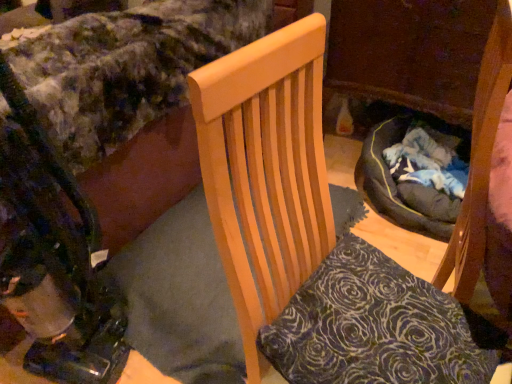
What do you see at coordinates (377, 327) in the screenshot? I see `velvety dark blue pillow at center` at bounding box center [377, 327].

The image size is (512, 384). Describe the element at coordinates (265, 171) in the screenshot. I see `wooden chair at center` at that location.

What do you see at coordinates (52, 256) in the screenshot?
I see `metallic black baby carriage at lower left` at bounding box center [52, 256].

Identify the location of velvety floral bedspread at upper left. (131, 97).

Are wooden chair at center and metallic black baby carriage at lower left located far from each other?

wooden chair at center is actually quite close to metallic black baby carriage at lower left.

Is wooden chair at center inside the boundaries of metallic black baby carriage at lower left, or outside?

The correct answer is: outside.

From the image's perspective, is wooden chair at center beneath metallic black baby carriage at lower left?

Yes.

Considering the sizes of wooden chair at center and metallic black baby carriage at lower left in the image, is wooden chair at center taller or shorter than metallic black baby carriage at lower left?

Clearly, wooden chair at center is shorter compared to metallic black baby carriage at lower left.

From a real-world perspective, does wooden chair at center stand above velvety dark blue pillow at center?

Indeed, from a real-world perspective, wooden chair at center stands above velvety dark blue pillow at center.

How much distance is there between wooden chair at center and velvety dark blue pillow at center?

A distance of 7.84 inches exists between wooden chair at center and velvety dark blue pillow at center.

Find the location of a particular element. chair above the velvety dark blue pillow at center (from a real-world perspective) is located at coordinates (265, 171).

Which object is positioned more to the left, wooden chair at center or velvety dark blue pillow at center?

From the viewer's perspective, velvety dark blue pillow at center appears more on the left side.

From the image's perspective, is velvety dark blue pillow at center located above or below metallic black baby carriage at lower left?

velvety dark blue pillow at center is situated lower than metallic black baby carriage at lower left in the image.

Is point (301, 295) farther from viewer compared to point (74, 335)?

That is False.

Identify the location of pillow below the metallic black baby carriage at lower left (from the image's perspective). (377, 327).

Can you confirm if velvety dark blue pillow at center is positioned to the right of metallic black baby carriage at lower left?

Correct, you'll find velvety dark blue pillow at center to the right of metallic black baby carriage at lower left.

Would you say velvety floral bedspread at upper left is a long distance from velvety dark blue pillow at center?

velvety floral bedspread at upper left is near velvety dark blue pillow at center, not far away.

Is velvety floral bedspread at upper left inside the boundaries of velvety dark blue pillow at center, or outside?

velvety floral bedspread at upper left exists outside the volume of velvety dark blue pillow at center.

Which is more to the left, velvety floral bedspread at upper left or velvety dark blue pillow at center?

Positioned to the left is velvety floral bedspread at upper left.

Which object is closer to the camera, metallic black baby carriage at lower left or velvety floral bedspread at upper left?

metallic black baby carriage at lower left.

How far apart are metallic black baby carriage at lower left and velvety floral bedspread at upper left?

metallic black baby carriage at lower left is 40.96 centimeters away from velvety floral bedspread at upper left.

Does metallic black baby carriage at lower left have a lesser height compared to velvety floral bedspread at upper left?

Incorrect, the height of metallic black baby carriage at lower left does not fall short of that of velvety floral bedspread at upper left.

Is metallic black baby carriage at lower left aimed at velvety floral bedspread at upper left?

No, metallic black baby carriage at lower left is not turned towards velvety floral bedspread at upper left.

Does metallic black baby carriage at lower left contain wooden chair at center?

Actually, wooden chair at center is outside metallic black baby carriage at lower left.

From the image's perspective, is metallic black baby carriage at lower left positioned above or below wooden chair at center?

Clearly, from the image's perspective, metallic black baby carriage at lower left is above wooden chair at center.

Could you tell me if metallic black baby carriage at lower left is turned towards wooden chair at center?

No, metallic black baby carriage at lower left is not turned towards wooden chair at center.

Is velvety dark blue pillow at center wider or thinner than wooden chair at center?

Considering their sizes, velvety dark blue pillow at center looks slimmer than wooden chair at center.

From the image's perspective, who appears lower, velvety dark blue pillow at center or wooden chair at center?

velvety dark blue pillow at center appears lower in the image.

Is velvety dark blue pillow at center spatially inside wooden chair at center, or outside of it?

velvety dark blue pillow at center can be found inside wooden chair at center.

Is wooden chair at center at the back of velvety dark blue pillow at center?

Correct, velvety dark blue pillow at center is looking away from wooden chair at center.

Locate an element on the screen. The height and width of the screenshot is (384, 512). baby carriage lying behind the wooden chair at center is located at coordinates (52, 256).

Locate an element on the screen. This screenshot has width=512, height=384. chair that appears on the right of velvety dark blue pillow at center is located at coordinates (265, 171).

Looking at the image, which one is located closer to metallic black baby carriage at lower left, velvety floral bedspread at upper left or wooden chair at center?

velvety floral bedspread at upper left is positioned closer to the anchor metallic black baby carriage at lower left.

When comparing their distances from metallic black baby carriage at lower left, does velvety dark blue pillow at center or velvety floral bedspread at upper left seem closer?

velvety floral bedspread at upper left is closer to metallic black baby carriage at lower left.

In the scene shown: Looking at the image, which one is located closer to wooden chair at center, metallic black baby carriage at lower left or velvety floral bedspread at upper left?

The object closer to wooden chair at center is metallic black baby carriage at lower left.

Based on their spatial positions, is wooden chair at center or velvety dark blue pillow at center further from metallic black baby carriage at lower left?

Among the two, velvety dark blue pillow at center is located further to metallic black baby carriage at lower left.

Considering their positions, is metallic black baby carriage at lower left positioned further to velvety floral bedspread at upper left than wooden chair at center?

wooden chair at center is positioned further to the anchor velvety floral bedspread at upper left.

From the picture: Estimate the real-world distances between objects in this image. Which object is further from velvety dark blue pillow at center, wooden chair at center or metallic black baby carriage at lower left?

The object further to velvety dark blue pillow at center is metallic black baby carriage at lower left.

From the image, which object appears to be nearer to velvety floral bedspread at upper left, metallic black baby carriage at lower left or velvety dark blue pillow at center?

metallic black baby carriage at lower left is positioned closer to the anchor velvety floral bedspread at upper left.

Looking at the image, which one is located further to wooden chair at center, metallic black baby carriage at lower left or velvety dark blue pillow at center?

Among the two, metallic black baby carriage at lower left is located further to wooden chair at center.

I want to click on pillow situated between metallic black baby carriage at lower left and wooden chair at center from left to right, so click(377, 327).

Locate an element on the screen. The width and height of the screenshot is (512, 384). pillow between velvety floral bedspread at upper left and wooden chair at center from left to right is located at coordinates (377, 327).

Find the location of a particular element. baby carriage between velvety floral bedspread at upper left and velvety dark blue pillow at center from left to right is located at coordinates (52, 256).

At what (x,y) coordinates should I click in order to perform the action: click on baby carriage situated between velvety floral bedspread at upper left and wooden chair at center from left to right. Please return your answer as a coordinate pair (x, y). This screenshot has height=384, width=512. Looking at the image, I should click on (52, 256).